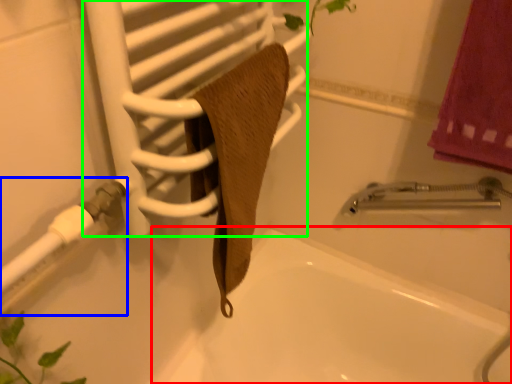
Question: Which object is the closest to the bath (highlighted by a red box)? Choose among these: shower (highlighted by a blue box) or screen door (highlighted by a green box).

Choices:
 (A) shower
 (B) screen door

Answer: (B)